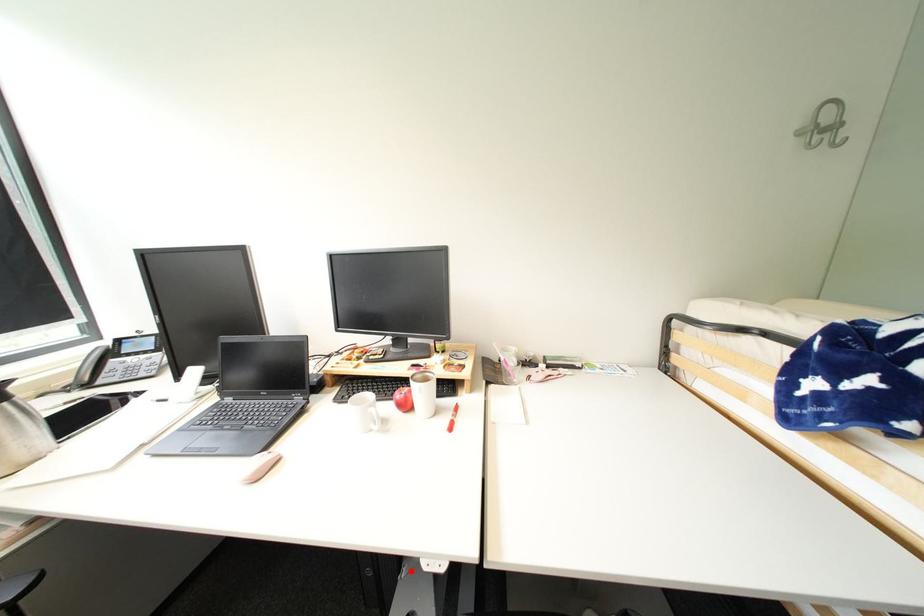
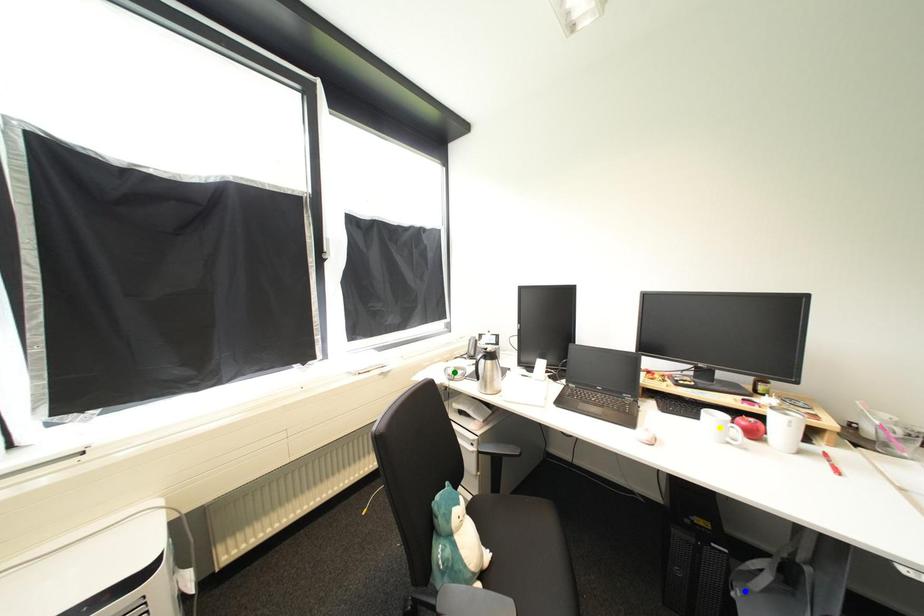
Question: I am providing you with two images of the same scene from different viewpoints. A red point is marked on the first image. You are given multiple points on the second image. Which mark in image 2 goes with the point in image 1?

Choices:
 (A) yellow point
 (B) blue point
 (C) green point

Answer: (B)